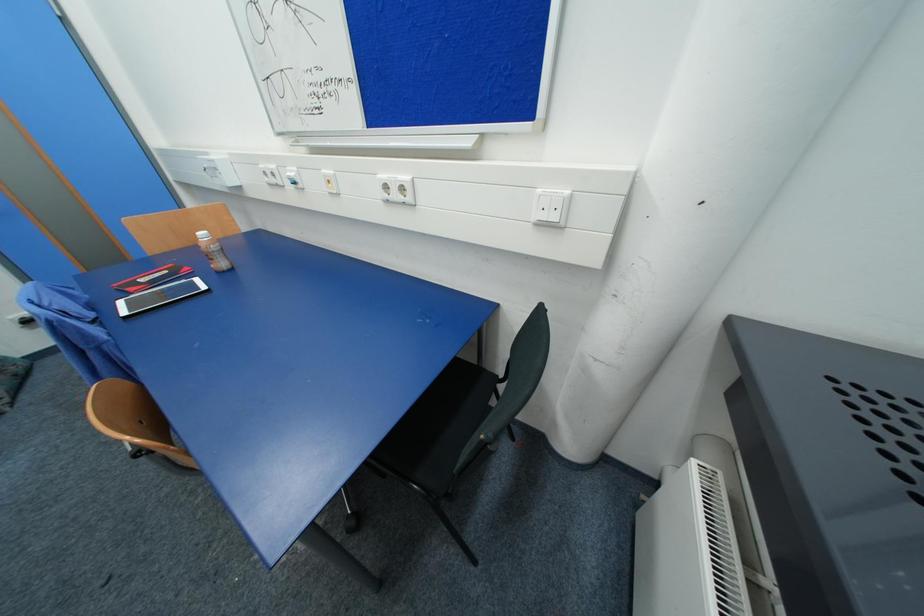
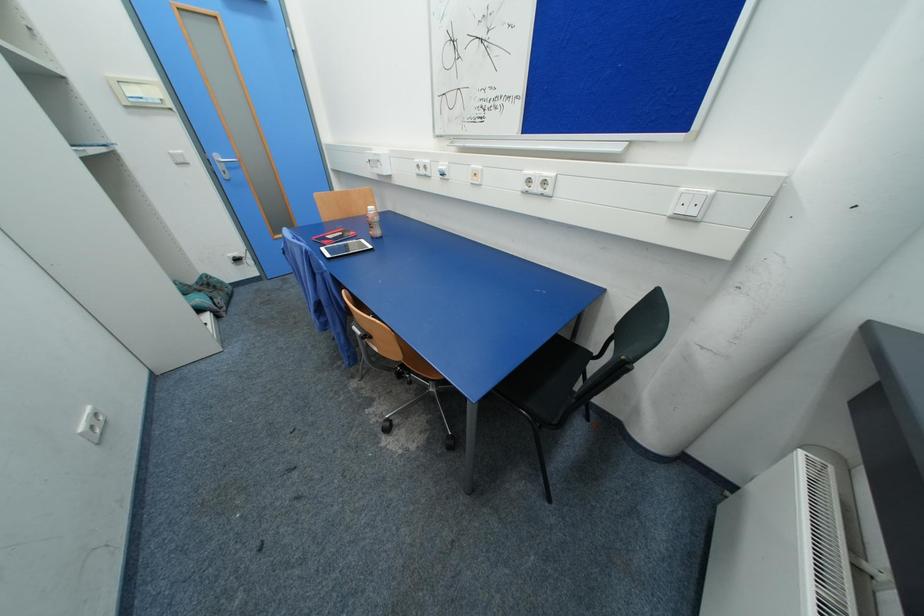
Based on the photo, which direction would the cameraman need to move to produce the second image?

The cameraman moved toward left, backward.